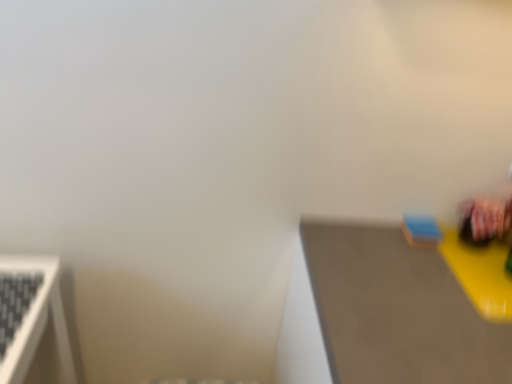
Where is `unoccupied area in front of blue matte sponge at upper right, which is the first toy in left-to-right order`? The image size is (512, 384). unoccupied area in front of blue matte sponge at upper right, which is the first toy in left-to-right order is located at coordinates (441, 274).